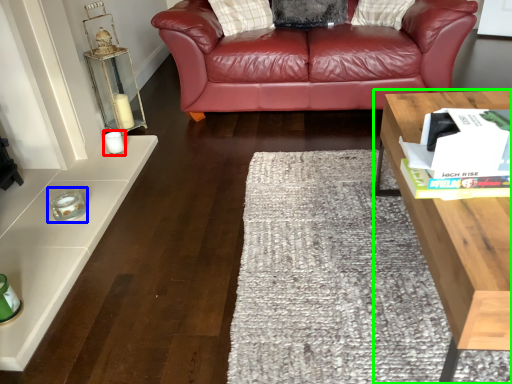
Question: Which object is positioned farthest from candle holder (highlighted by a red box)? Select from candle holder (highlighted by a blue box) and table (highlighted by a green box).

Choices:
 (A) candle holder
 (B) table

Answer: (B)